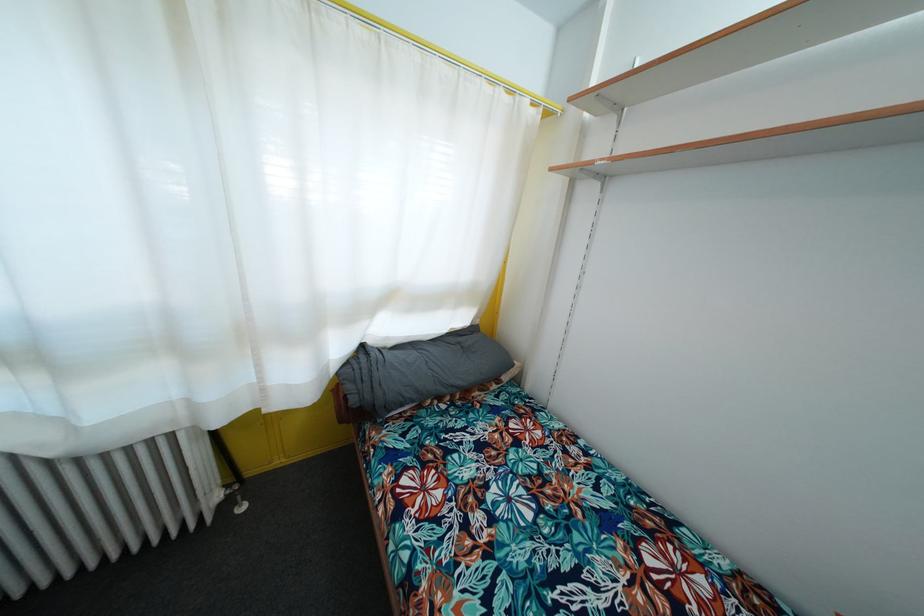
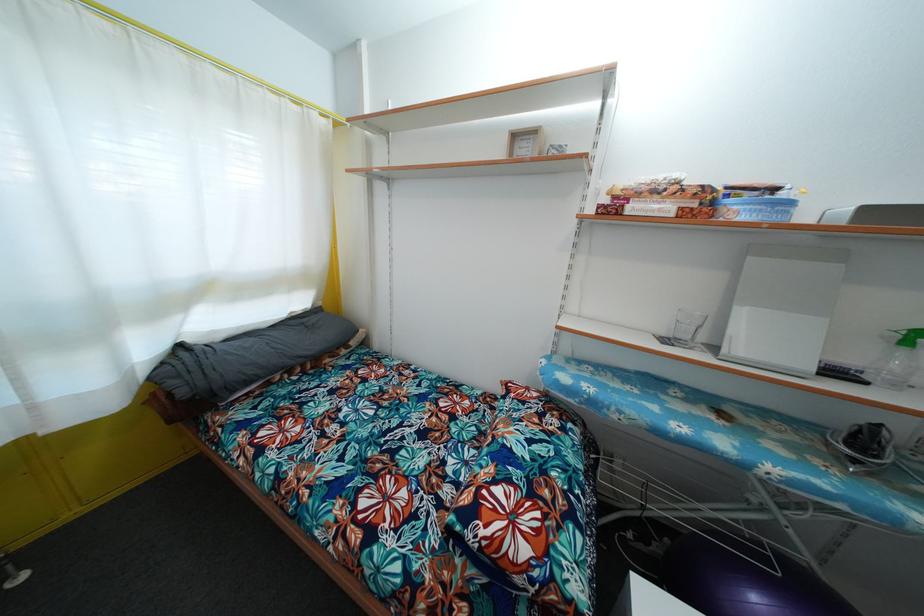
In the second image, find the point that corresponds to the point at 358,407 in the first image.

(187, 399)